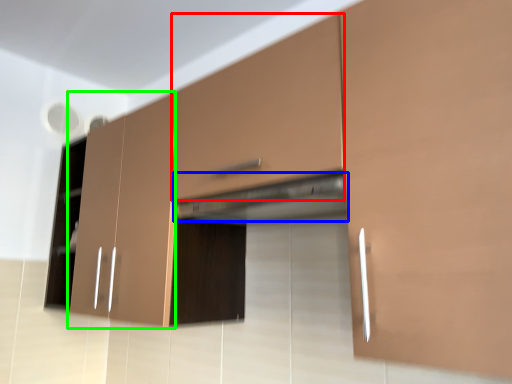
Question: Which object is the closest to the drawer (highlighted by a red box)? Choose among these: exhaust hood (highlighted by a blue box) or cabinetry (highlighted by a green box).

Choices:
 (A) exhaust hood
 (B) cabinetry

Answer: (A)